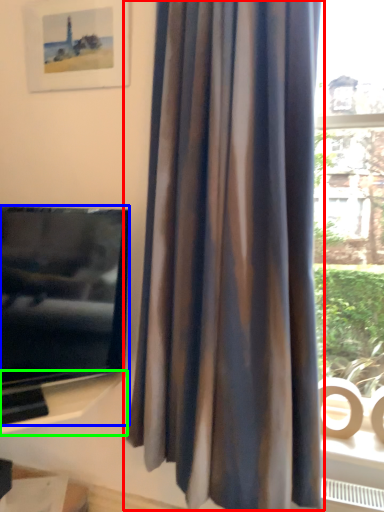
Question: Which object is the closest to the curtain (highlighted by a red box)? Choose among these: television (highlighted by a blue box) or shelf (highlighted by a green box).

Choices:
 (A) television
 (B) shelf

Answer: (A)